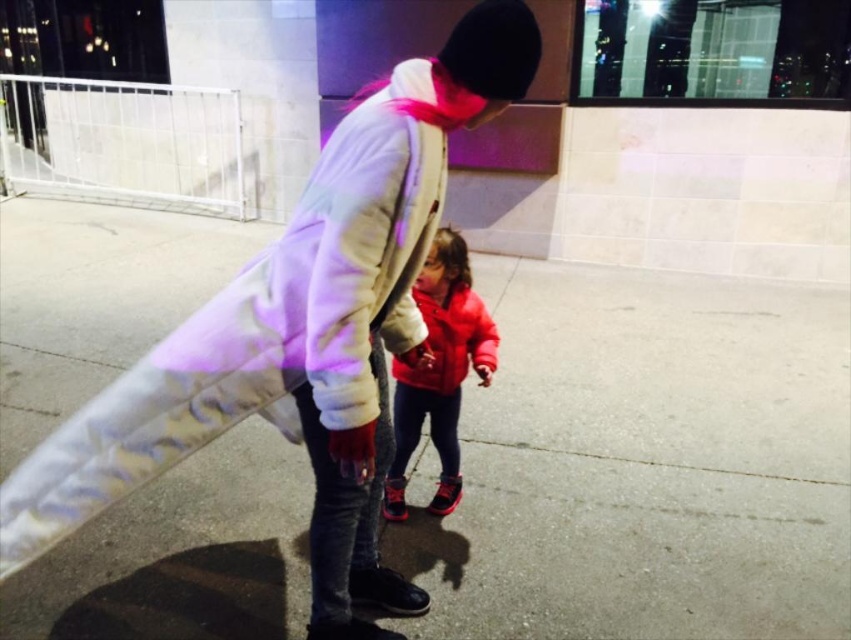
Measure the distance between white fleece jacket at center and matte red jacket at center.

white fleece jacket at center and matte red jacket at center are 15.85 inches apart from each other.

In the scene shown: Does white fleece jacket at center appear over matte red jacket at center?

Indeed, white fleece jacket at center is positioned over matte red jacket at center.

Does point (334, 330) lie behind point (433, 273)?

That is False.

Identify the location of white fleece jacket at center. (300, 333).

Is smooth concrete pavement at center above matte red sweatshirt at center?

Actually, smooth concrete pavement at center is below matte red sweatshirt at center.

Identify the location of smooth concrete pavement at center. The width and height of the screenshot is (851, 640). (643, 464).

Image resolution: width=851 pixels, height=640 pixels. In order to click on smooth concrete pavement at center in this screenshot , I will do `click(643, 464)`.

The height and width of the screenshot is (640, 851). What are the coordinates of `smooth concrete pavement at center` in the screenshot? It's located at (643, 464).

From the picture: Between white fleece jacket at center and matte red sweatshirt at center, which one has more height?

white fleece jacket at center is taller.

Is white fleece jacket at center positioned behind matte red sweatshirt at center?

No, it is not.

The image size is (851, 640). I want to click on white fleece jacket at center, so click(x=300, y=333).

The width and height of the screenshot is (851, 640). Identify the location of white fleece jacket at center. click(x=300, y=333).